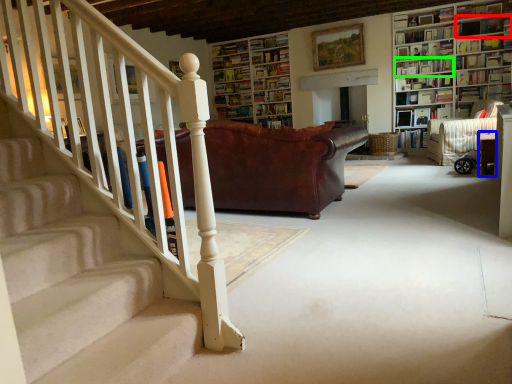
Question: Which is nearer to the book (highlighted by a red box)? furniture (highlighted by a blue box) or book (highlighted by a green box).

Choices:
 (A) furniture
 (B) book

Answer: (B)